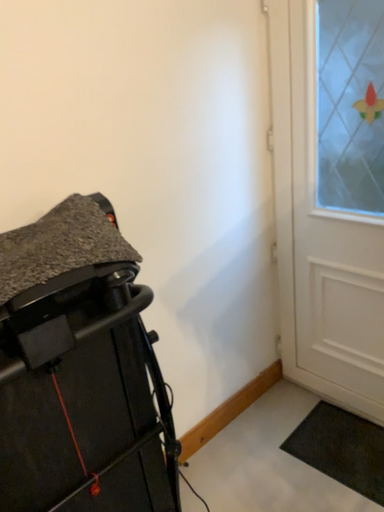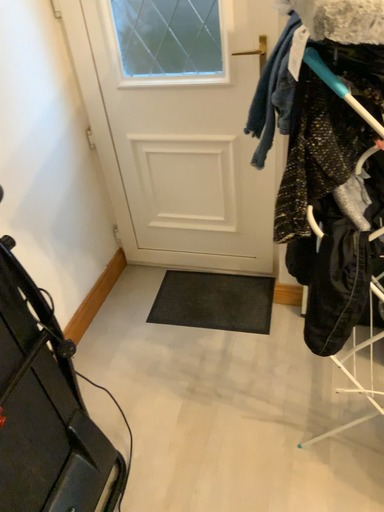
Question: Which way did the camera rotate in the video?

Choices:
 (A) rotated upward
 (B) rotated downward

Answer: (B)